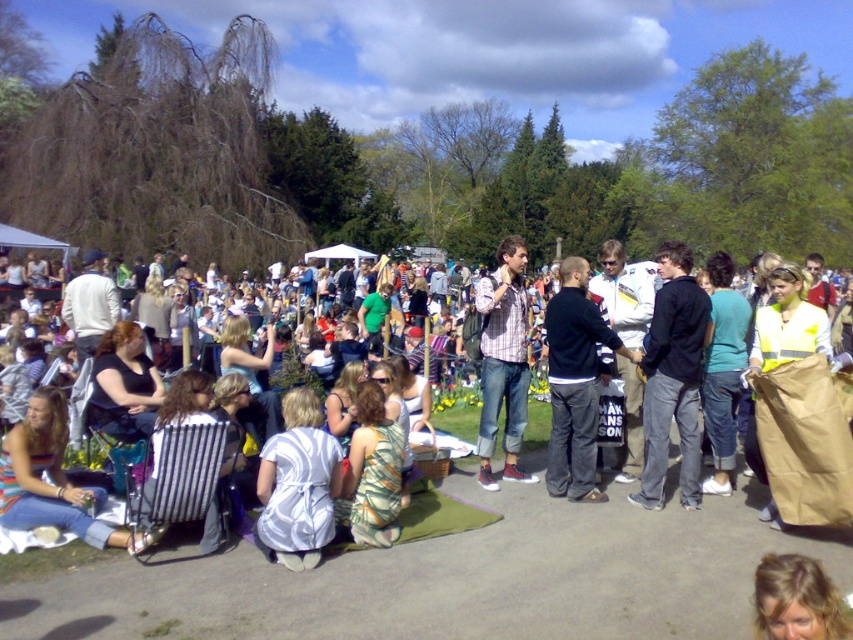
Can you confirm if black cotton jacket at center is taller than dark gray sweater at center?

Yes.

Does black cotton jacket at center have a smaller size compared to dark gray sweater at center?

Incorrect, black cotton jacket at center is not smaller in size than dark gray sweater at center.

Image resolution: width=853 pixels, height=640 pixels. Describe the element at coordinates (672, 378) in the screenshot. I see `black cotton jacket at center` at that location.

Locate an element on the screen. The image size is (853, 640). black cotton jacket at center is located at coordinates (672, 378).

Based on the photo, is dark gray sweater at center taller than plaid shirt at center?

No, dark gray sweater at center is not taller than plaid shirt at center.

Does dark gray sweater at center appear on the left side of plaid shirt at center?

No, dark gray sweater at center is not to the left of plaid shirt at center.

Find the location of a particular element. dark gray sweater at center is located at coordinates (575, 381).

Locate an element on the screen. dark gray sweater at center is located at coordinates point(575,381).

Can you confirm if black cotton jacket at center is wider than plaid shirt at center?

Correct, the width of black cotton jacket at center exceeds that of plaid shirt at center.

Who is more forward, (683, 378) or (500, 244)?

Point (683, 378) is more forward.

What do you see at coordinates (672, 378) in the screenshot?
I see `black cotton jacket at center` at bounding box center [672, 378].

At what (x,y) coordinates should I click in order to perform the action: click on black cotton jacket at center. Please return your answer as a coordinate pair (x, y). Image resolution: width=853 pixels, height=640 pixels. Looking at the image, I should click on (672, 378).